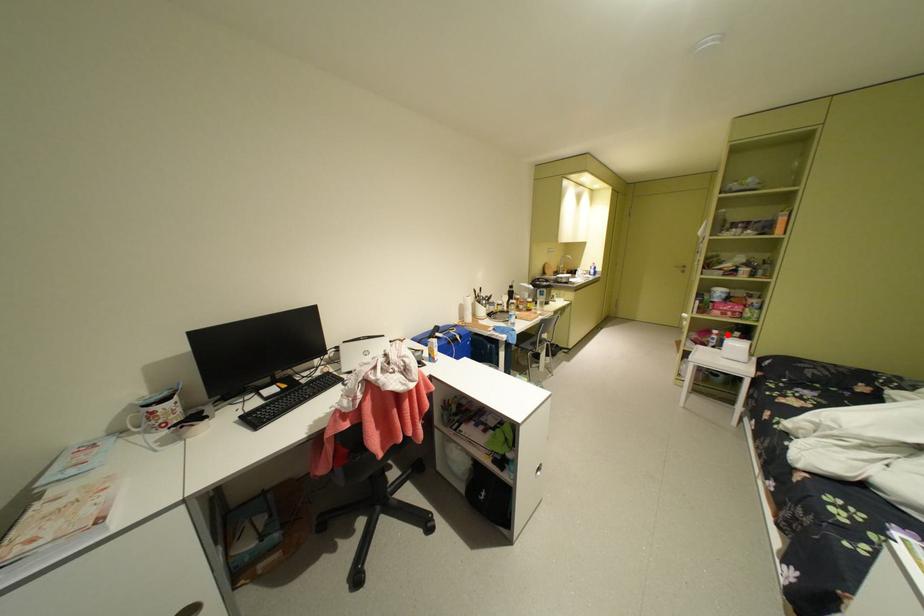
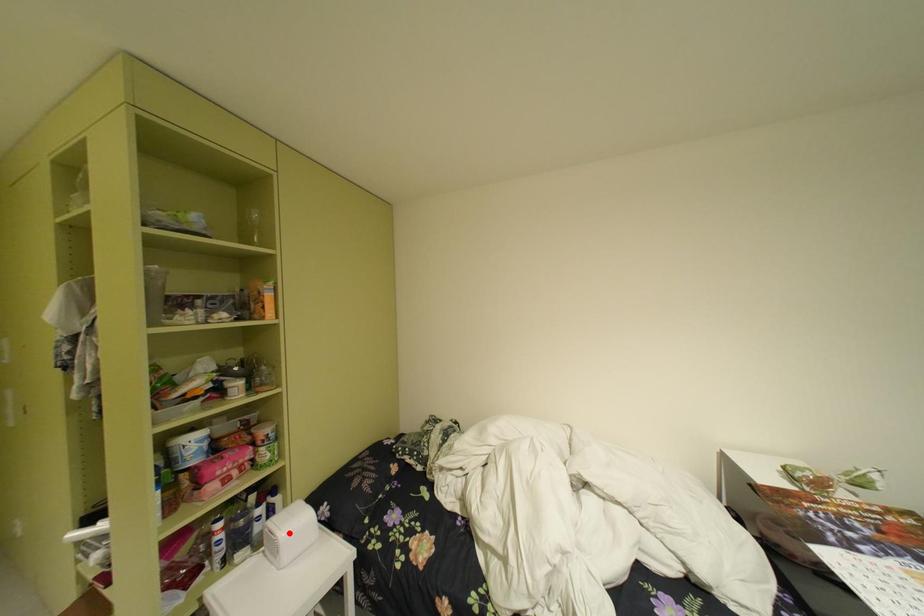
I am providing you with two images of the same scene from different viewpoints. A red point is marked on the first image and another point is marked on the second image. Is the red point in image1 aligned with the point shown in image2?

No